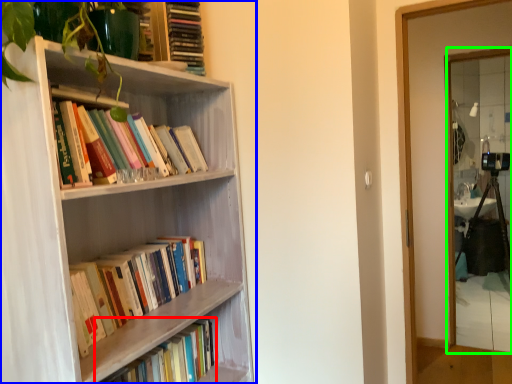
Question: Based on their relative distances, which object is nearer to book (highlighted by a red box)? Choose from bookcase (highlighted by a blue box) and mirror (highlighted by a green box).

Choices:
 (A) bookcase
 (B) mirror

Answer: (A)